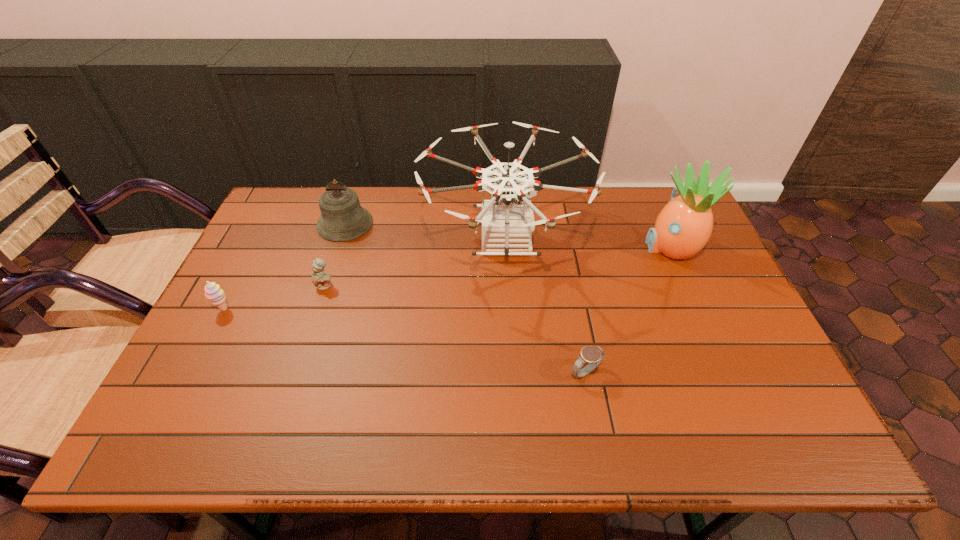
At what (x,y) coordinates should I click in order to perform the action: click on blank region between the watch and the pineapple. Please return your answer as a coordinate pair (x, y). Looking at the image, I should click on (628, 309).

Locate an element on the screen. Image resolution: width=960 pixels, height=540 pixels. free point between the nearest object and the third tallest object is located at coordinates (466, 298).

Image resolution: width=960 pixels, height=540 pixels. What are the coordinates of `empty location between the bell and the watch` in the screenshot? It's located at (466, 298).

Where is `free spot between the fourth shortest object and the watch`? free spot between the fourth shortest object and the watch is located at coordinates (466, 298).

This screenshot has height=540, width=960. In order to click on empty space that is in between the watch and the pineapple in this screenshot , I will do click(628, 309).

Locate which object ranks third in proximity to the fourth shortest object. Please provide its 2D coordinates. Your answer should be formatted as a tuple, i.e. [(x, y)], where the tuple contains the x and y coordinates of a point satisfying the conditions above.

[(213, 292)]

The image size is (960, 540). In order to click on object that is the third closest to the nearest object in this screenshot , I will do 321,279.

I want to click on vacant space that satisfies the following two spatial constraints: 1. on the front side of the leftmost object; 2. on the left side of the shortest object, so click(x=192, y=373).

Identify the location of free space that satisfies the following two spatial constraints: 1. at the entrance of the rightmost object; 2. on the front-facing side of the teddy bear. This screenshot has width=960, height=540. (687, 286).